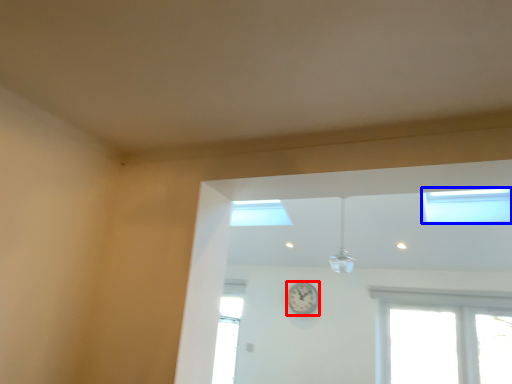
Question: Which object is further to the camera taking this photo, clock (highlighted by a red box) or window (highlighted by a blue box)?

Choices:
 (A) clock
 (B) window

Answer: (A)